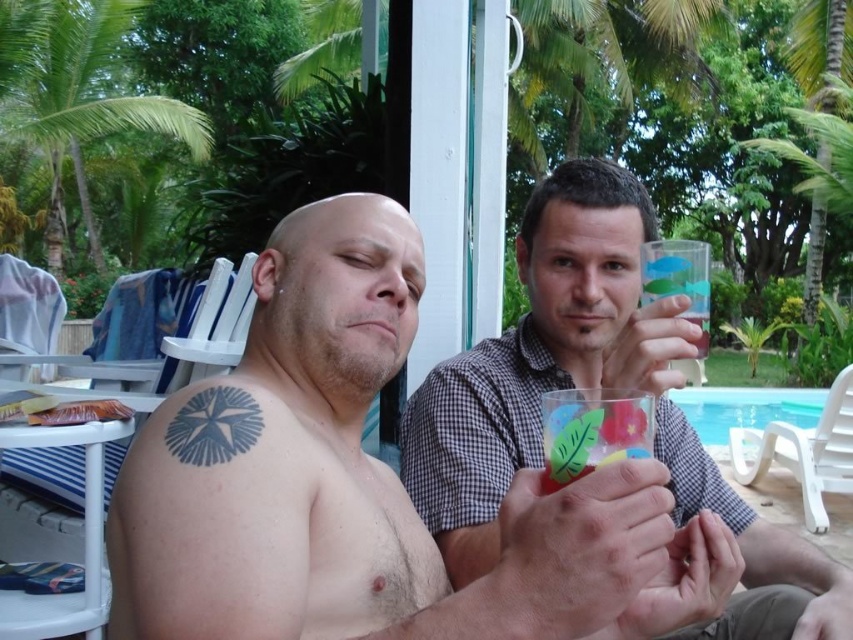
You are at a poolside party and want to grab a drink. There are two cups in front of you, a shiny metallic cup at center and a transparent glass at center. Which one is more to your left?

The shiny metallic cup at center is positioned on the left side of the transparent glass at center, so it is more to the left.

You are standing 5 feet away from the point at coordinates point (x=535, y=374). If you take a step forward of 1.5 feet, will you be closer than 3 feet to the point?

The distance of point (x=535, y=374) from viewer is 3.66 feet. After stepping forward 1.5 feet, your distance becomes 3.66 minus 1.5 equals 2.16 feet, which is less than 3 feet. So yes, you will be closer than 3 feet to the point.